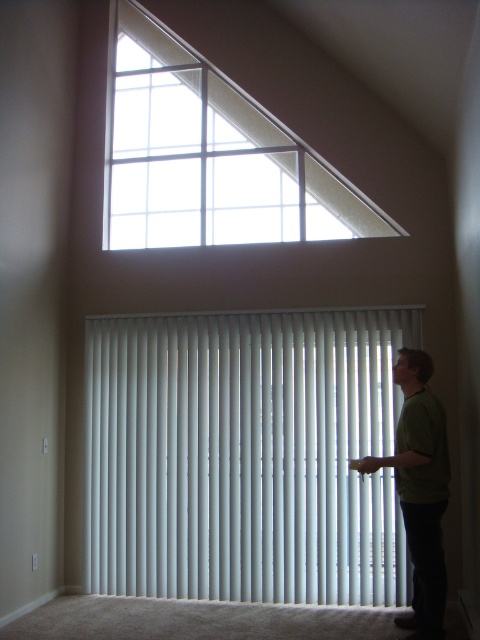
Does point (362, 339) come closer to viewer compared to point (411, 524)?

No, it is behind (411, 524).

Can you confirm if white vertical blinds at center is thinner than green matte shirt at right?

No.

Find the location of a particular element. The height and width of the screenshot is (640, 480). white vertical blinds at center is located at coordinates (244, 456).

Locate an element on the screen. white vertical blinds at center is located at coordinates (244, 456).

Is clear glass window at upper center to the left of green matte shirt at right from the viewer's perspective?

Indeed, clear glass window at upper center is positioned on the left side of green matte shirt at right.

Who is positioned more to the left, clear glass window at upper center or green matte shirt at right?

From the viewer's perspective, clear glass window at upper center appears more on the left side.

Identify the location of clear glass window at upper center. The width and height of the screenshot is (480, 640). (208, 134).

Does white vertical blinds at center appear on the right side of clear glass window at upper center?

Indeed, white vertical blinds at center is positioned on the right side of clear glass window at upper center.

Is white vertical blinds at center taller than clear glass window at upper center?

Indeed, white vertical blinds at center has a greater height compared to clear glass window at upper center.

Locate an element on the screen. white vertical blinds at center is located at coordinates (244, 456).